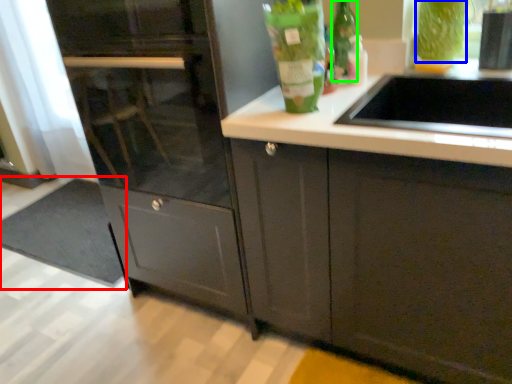
Question: Which is farther away from doormat (highlighted by a red box)? drink (highlighted by a blue box) or glass bottle (highlighted by a green box)?

Choices:
 (A) drink
 (B) glass bottle

Answer: (A)